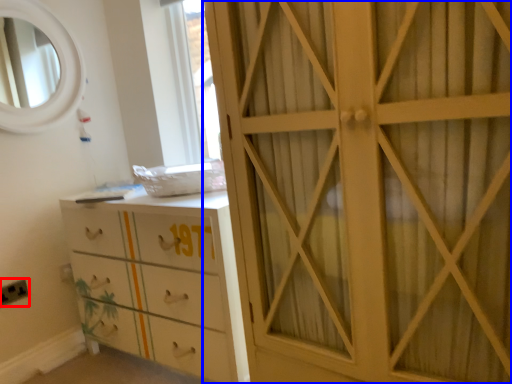
Question: Among these objects, which one is nearest to the camera, electric outlet (highlighted by a red box) or cupboard (highlighted by a blue box)?

Choices:
 (A) electric outlet
 (B) cupboard

Answer: (B)